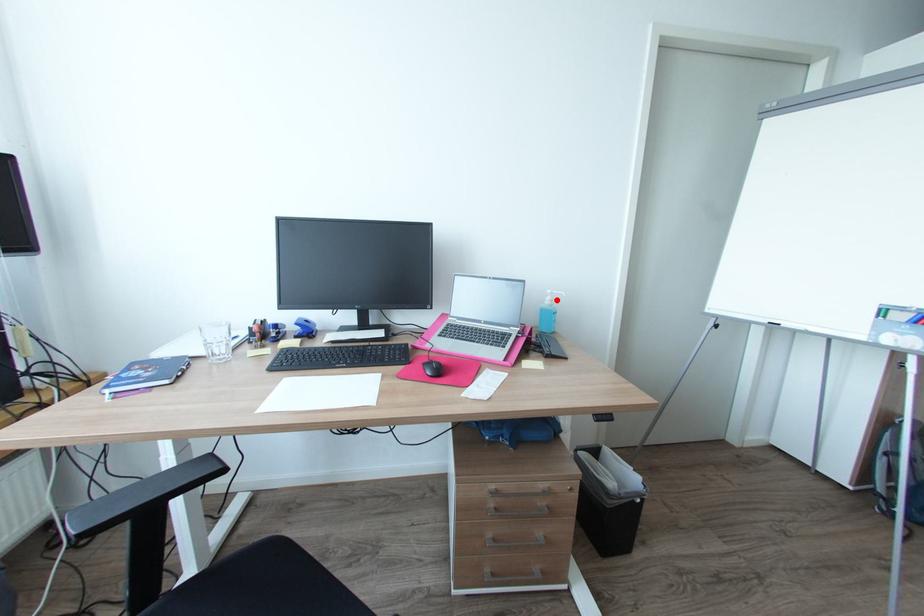
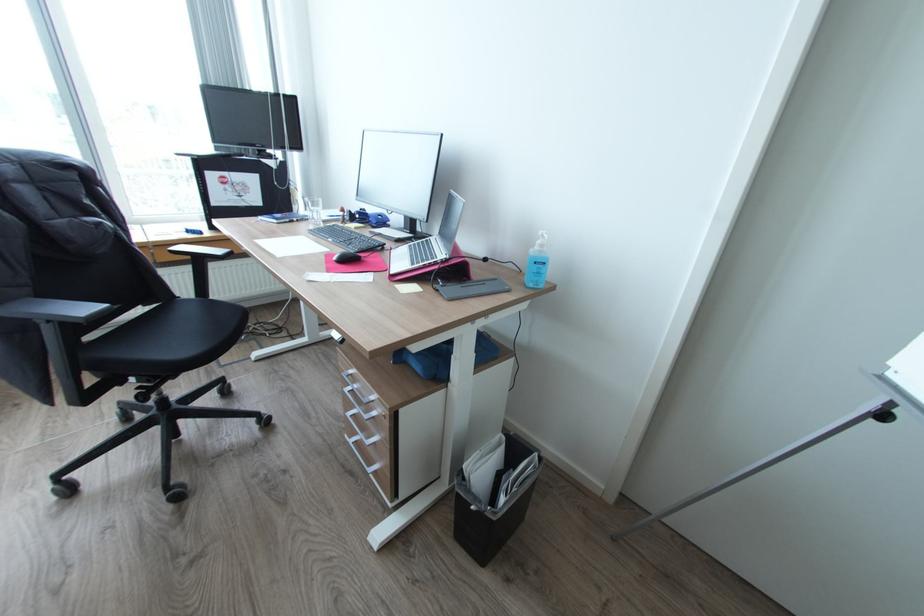
The point at the highlighted location is marked in the first image. Where is the corresponding point in the second image?

(545, 245)